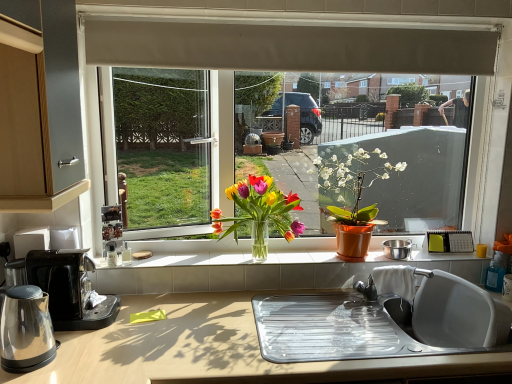
I want to click on free space to the right of shiny metallic kettle at left, so click(x=81, y=369).